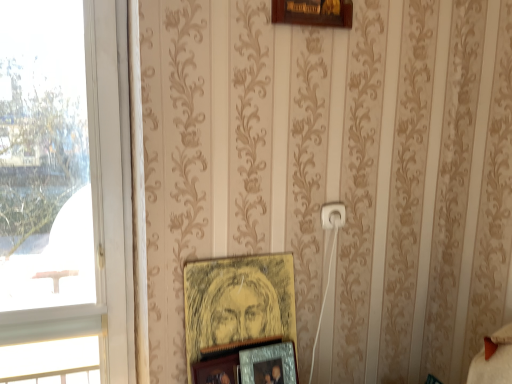
Question: Considering the positions of metallic silver photo frame at lower center, which is the 2th picture frame from top to bottom, and wooden picture frame at lower center, the third picture frame positioned from the top, in the image, is metallic silver photo frame at lower center, which is the 2th picture frame from top to bottom, taller or shorter than wooden picture frame at lower center, the third picture frame positioned from the top,?

Choices:
 (A) tall
 (B) short

Answer: (A)

Question: From the image's perspective, is metallic silver photo frame at lower center, the 2th picture frame positioned from the bottom, above or below wooden picture frame at lower center, the third picture frame positioned from the top?

Choices:
 (A) below
 (B) above

Answer: (B)

Question: Which is nearer to the wooden picture frame at lower center, the third picture frame positioned from the top?

Choices:
 (A) metallic silver photo frame at lower center, which is the 2th picture frame from top to bottom
 (B) yellow paper picture frame at center, which is the first picture frame from top to bottom
 (C) white plastic electric outlet at center
 (D) transparent glass window at left

Answer: (A)

Question: Considering the real-world distances, which object is closest to the white plastic electric outlet at center?

Choices:
 (A) transparent glass window at left
 (B) metallic silver photo frame at lower center, which is the 2th picture frame from top to bottom
 (C) wooden picture frame at lower center, the third picture frame positioned from the top
 (D) yellow paper picture frame at center, which is the first picture frame from top to bottom

Answer: (D)